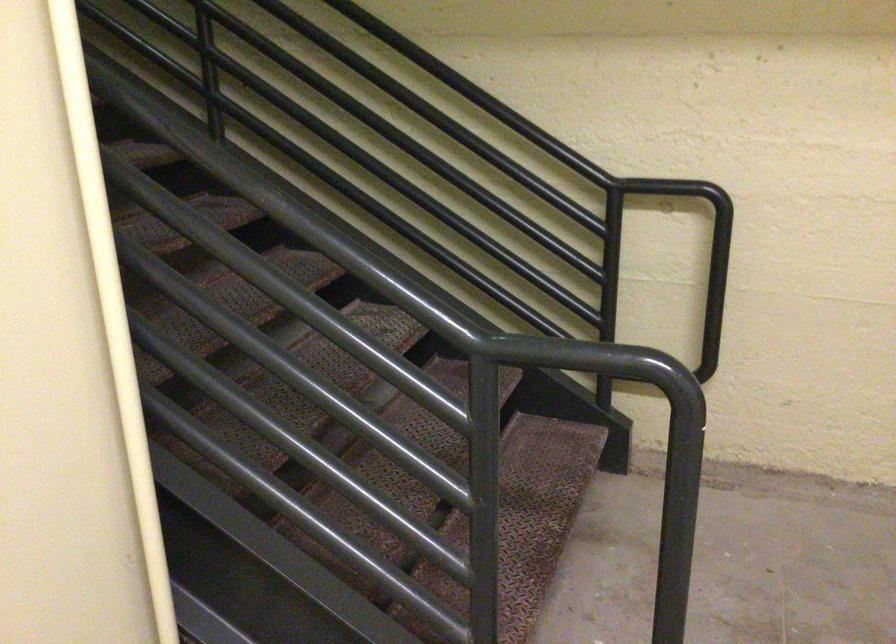
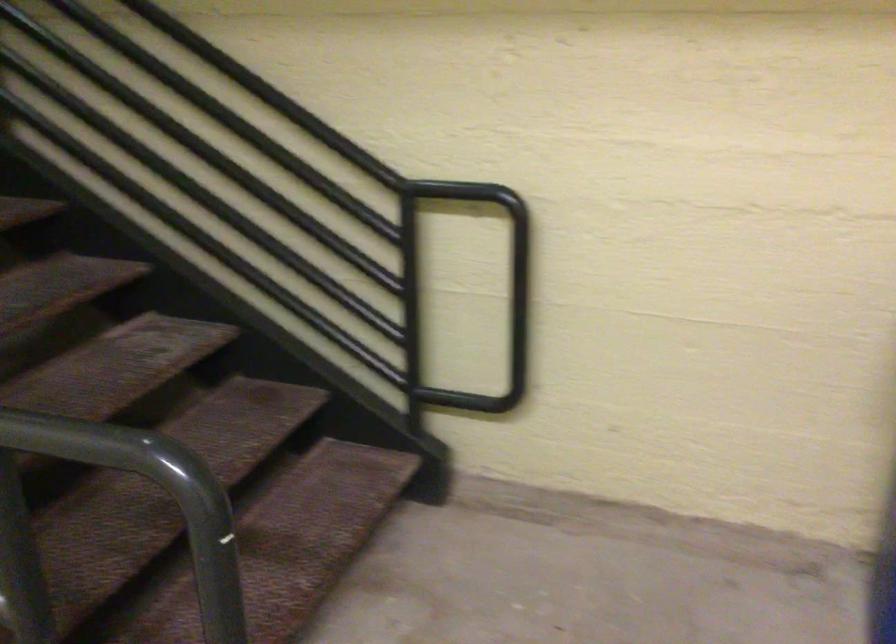
What movement of the cameraman would produce the second image?

The movement direction of the cameraman is right, forward.